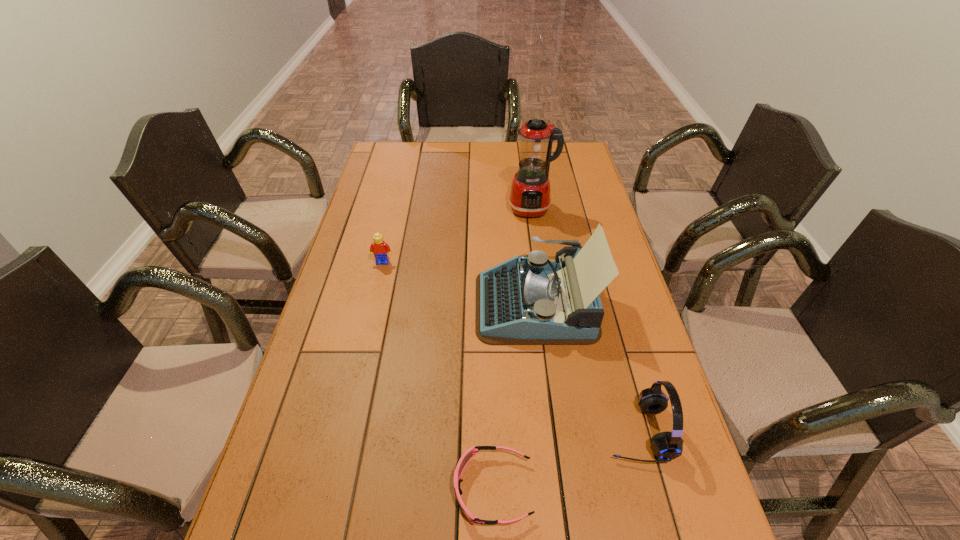
At what (x,y) coordinates should I click in order to perform the action: click on free spot between the fourth shortest object and the third tallest object. Please return your answer as a coordinate pair (x, y). Looking at the image, I should click on (587, 368).

This screenshot has height=540, width=960. What are the coordinates of `vacant space in between the typewriter and the leftmost object` in the screenshot? It's located at (459, 283).

Identify which object is the second closest to the farthest object. Please provide its 2D coordinates. Your answer should be formatted as a tuple, i.e. [(x, y)], where the tuple contains the x and y coordinates of a point satisfying the conditions above.

[(380, 249)]

At what (x,y) coordinates should I click in order to perform the action: click on object that stands as the fourth closest to the fourth tallest object. Please return your answer as a coordinate pair (x, y). The height and width of the screenshot is (540, 960). Looking at the image, I should click on (667, 446).

Find the location of a particular element. This screenshot has height=540, width=960. free space that satisfies the following two spatial constraints: 1. on the controls of the food processor; 2. on the front-facing side of the shortest object is located at coordinates [x=571, y=489].

Image resolution: width=960 pixels, height=540 pixels. I want to click on vacant region that satisfies the following two spatial constraints: 1. on the controls of the food processor; 2. on the front-facing side of the goggles, so click(571, 489).

Find the location of `free space that satisfies the following two spatial constraints: 1. on the controls of the farthest object; 2. on the front-facing side of the shortest object`. free space that satisfies the following two spatial constraints: 1. on the controls of the farthest object; 2. on the front-facing side of the shortest object is located at coordinates (571, 489).

The height and width of the screenshot is (540, 960). Find the location of `free location that satisfies the following two spatial constraints: 1. on the controls of the farthest object; 2. on the typing side of the second tallest object`. free location that satisfies the following two spatial constraints: 1. on the controls of the farthest object; 2. on the typing side of the second tallest object is located at coordinates pos(545,304).